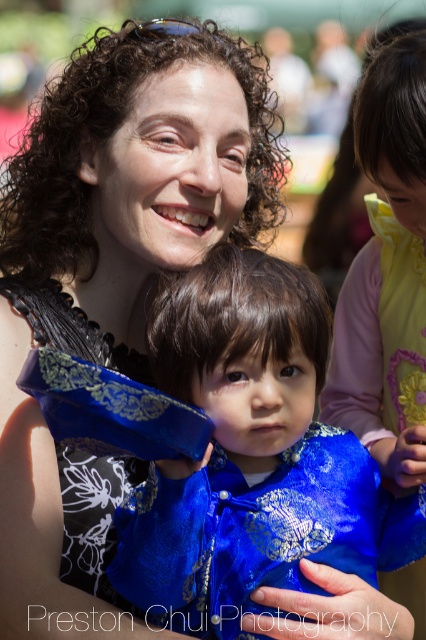
You are standing at the point marked as point (63, 524) in the image. You want to take a photo of the woman in black sleeveless top with floral pattern on the shoulders. Is this point close enough to capture her entire body in the photo?

The distance of point (63, 524) from camera is 8.45 feet. To capture the entire body of the woman in black sleeveless top with floral pattern on the shoulders, you need to be at least 10 feet away. Therefore, this point is too close.

You are a photographer trying to capture a closeup of the blue silk kimono at center without the matte black dress at upper left appearing in the frame. Is this possible given their positions?

The matte black dress at upper left is located above the blue silk kimono at center, so it would likely appear in the frame if you focus on the kimono. Adjust your angle or zoom in to exclude the dress.